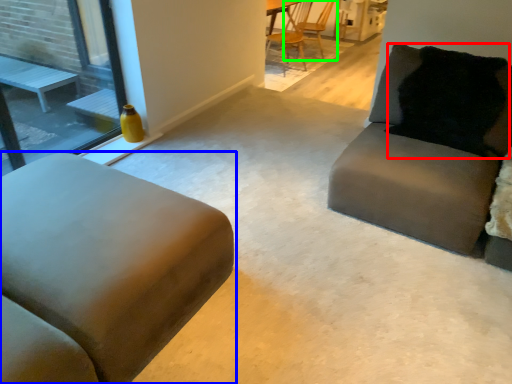
Question: Which object is positioned closest to pillow (highlighted by a red box)? Select from studio couch (highlighted by a blue box) and chair (highlighted by a green box).

Choices:
 (A) studio couch
 (B) chair

Answer: (A)